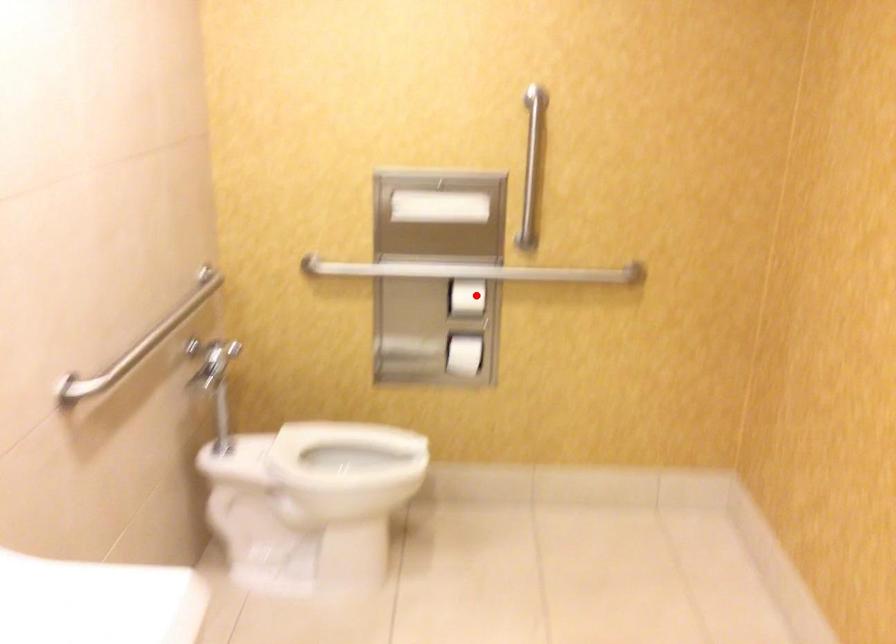
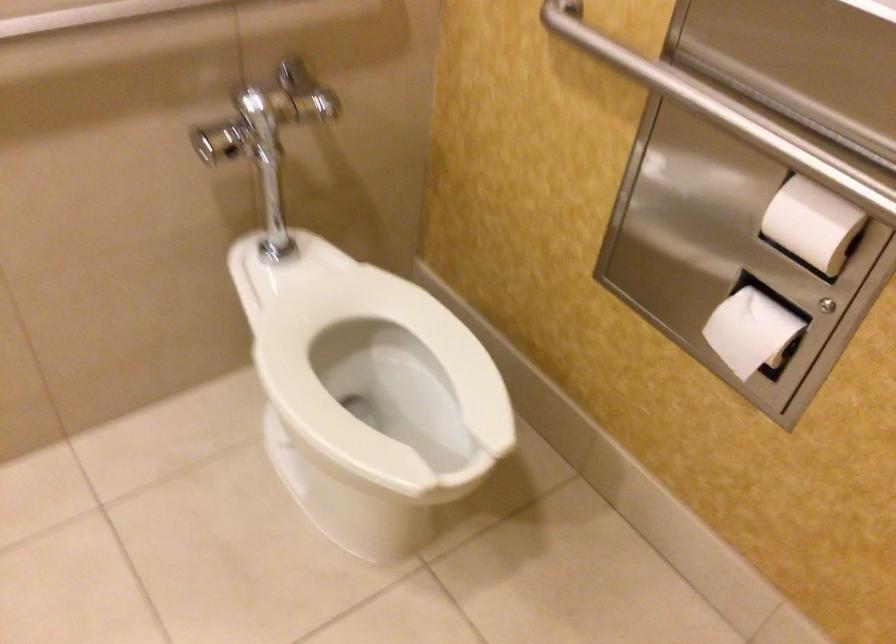
Question: A red point is marked in image1. In image2, is the corresponding 3D point closer to the camera or farther? Reply with the corresponding letter.

Choices:
 (A) The corresponding 3D point is closer.
 (B) The corresponding 3D point is farther.

Answer: (A)